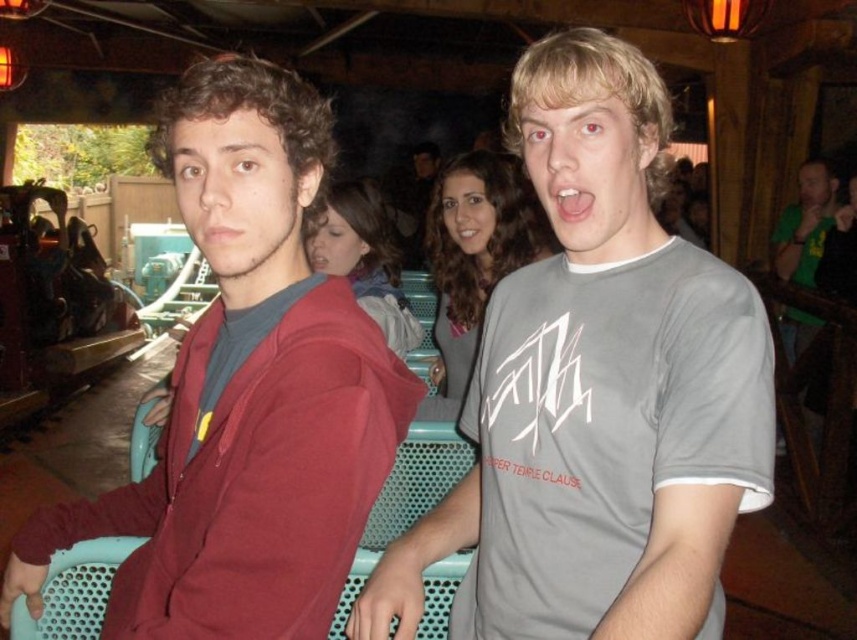
You are standing at the center of the amusement park and see the point at coordinates [246,392]. What object is located at that point?

The point at coordinates [246,392] indicates the matte red hoodie at left.

You are a photographer trying to capture a group photo of the matte red hoodie at left and the green matte shirt at right. Since you want both subjects to appear equally sized in the photo, which subject should you move closer to the camera and which should you move farther away?

The matte red hoodie at left is smaller than the green matte shirt at right. To make them appear the same size in the photo, move the matte red hoodie at left closer to the camera and the green matte shirt at right farther away.